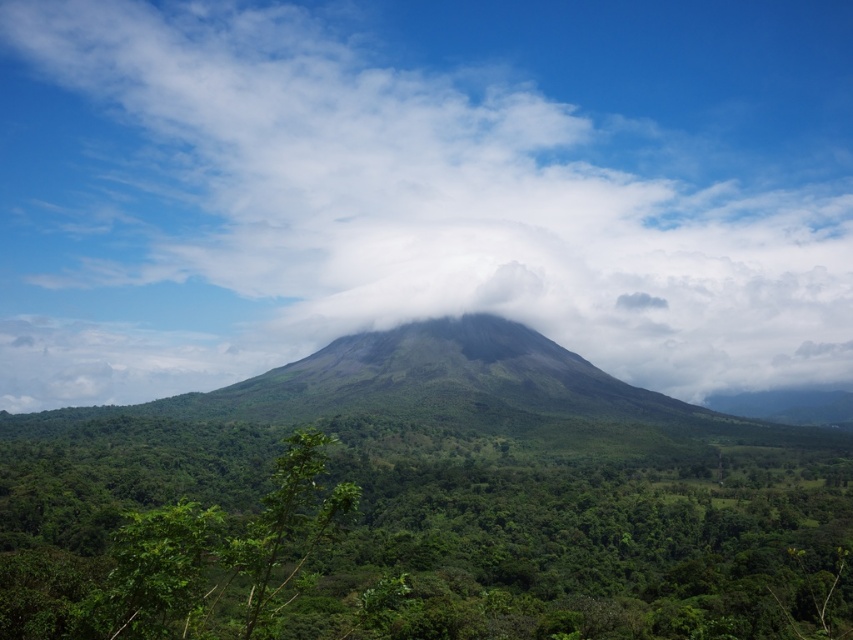
Question: Can you confirm if white fluffy cloud at center is smaller than green leafy forest at center?

Choices:
 (A) yes
 (B) no

Answer: (B)

Question: Which point is closer to the camera?

Choices:
 (A) white fluffy cloud at center
 (B) green leafy forest at center

Answer: (B)

Question: Is white fluffy cloud at center bigger than green leafy forest at center?

Choices:
 (A) yes
 (B) no

Answer: (A)

Question: Which point is closer to the camera?

Choices:
 (A) green leafy forest at center
 (B) white fluffy cloud at center

Answer: (A)

Question: Can you confirm if white fluffy cloud at center is wider than green leafy forest at center?

Choices:
 (A) no
 (B) yes

Answer: (B)